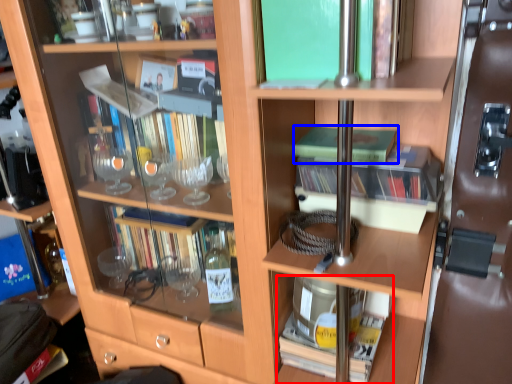
Question: Which of the following is the farthest to the observer, book (highlighted by a red box) or book (highlighted by a blue box)?

Choices:
 (A) book
 (B) book

Answer: (A)